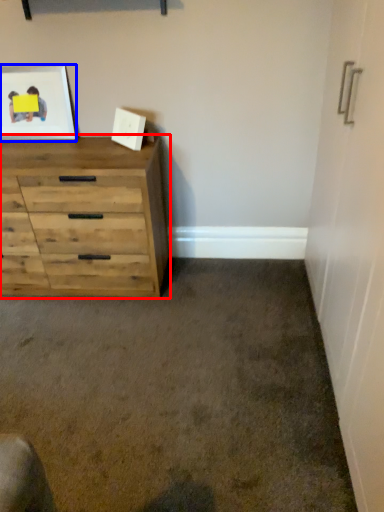
Question: Which of the following is the farthest to the observer, chest of drawers (highlighted by a red box) or picture frame (highlighted by a blue box)?

Choices:
 (A) chest of drawers
 (B) picture frame

Answer: (B)